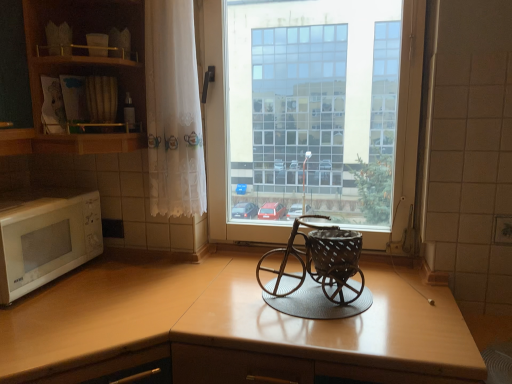
Question: From a real-world perspective, does wooden cabinet at upper left sit lower than wooden at center?

Choices:
 (A) no
 (B) yes

Answer: (A)

Question: Can you confirm if wooden cabinet at upper left is shorter than wooden at center?

Choices:
 (A) no
 (B) yes

Answer: (B)

Question: Is wooden cabinet at upper left positioned beyond the bounds of wooden at center?

Choices:
 (A) no
 (B) yes

Answer: (B)

Question: Is wooden cabinet at upper left taller than wooden at center?

Choices:
 (A) no
 (B) yes

Answer: (A)

Question: Is wooden at center a part of wooden cabinet at upper left?

Choices:
 (A) yes
 (B) no

Answer: (B)

Question: Considering their positions, is wooden at center located in front of or behind white matte microwave at left?

Choices:
 (A) behind
 (B) front

Answer: (B)

Question: Choose the correct answer: Is wooden at center inside white matte microwave at left or outside it?

Choices:
 (A) inside
 (B) outside

Answer: (B)

Question: From the image's perspective, is wooden at center positioned above or below white matte microwave at left?

Choices:
 (A) below
 (B) above

Answer: (A)

Question: Considering the positions of wooden at center and white matte microwave at left in the image, is wooden at center bigger or smaller than white matte microwave at left?

Choices:
 (A) small
 (B) big

Answer: (B)

Question: Is wooden at center in front of or behind transparent glass window at center in the image?

Choices:
 (A) front
 (B) behind

Answer: (A)

Question: Considering the relative positions of wooden at center and transparent glass window at center in the image provided, is wooden at center to the left or to the right of transparent glass window at center?

Choices:
 (A) right
 (B) left

Answer: (A)

Question: From the image's perspective, is wooden at center positioned above or below transparent glass window at center?

Choices:
 (A) above
 (B) below

Answer: (B)

Question: Is point (391, 307) positioned closer to the camera than point (402, 99)?

Choices:
 (A) closer
 (B) farther

Answer: (A)

Question: In terms of height, does transparent glass window at center look taller or shorter compared to wooden cabinet at upper left?

Choices:
 (A) tall
 (B) short

Answer: (A)

Question: Considering their positions, is transparent glass window at center located in front of or behind wooden cabinet at upper left?

Choices:
 (A) front
 (B) behind

Answer: (B)